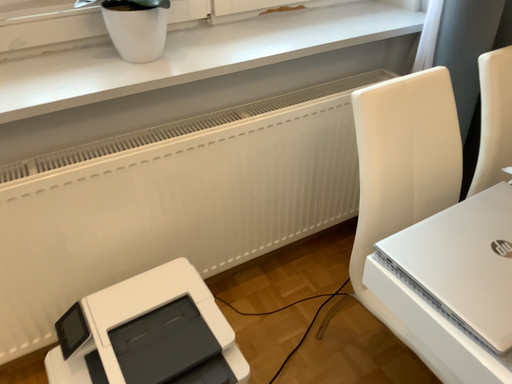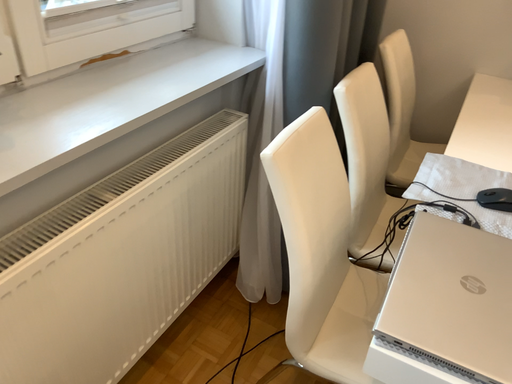
Question: Which way did the camera rotate in the video?

Choices:
 (A) rotated right
 (B) rotated left

Answer: (A)